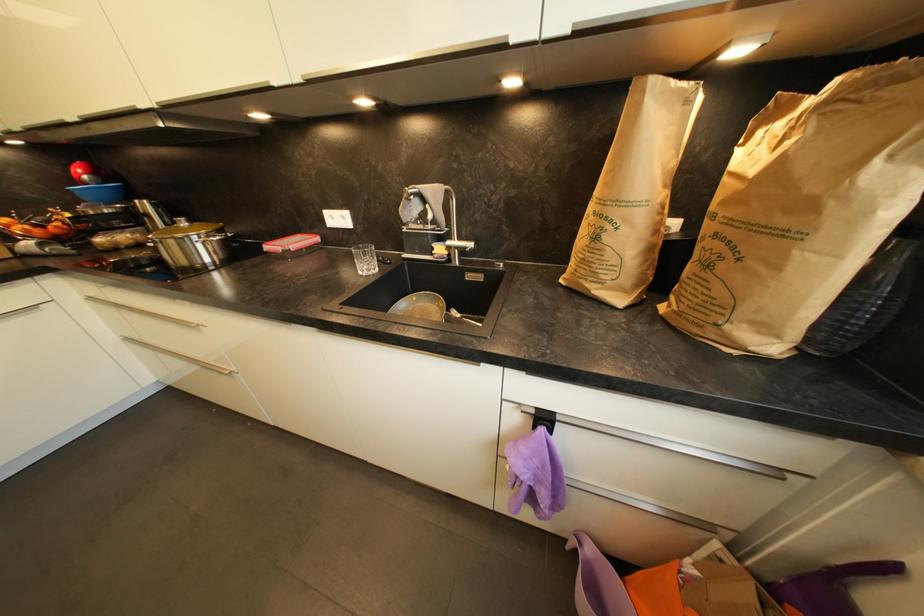
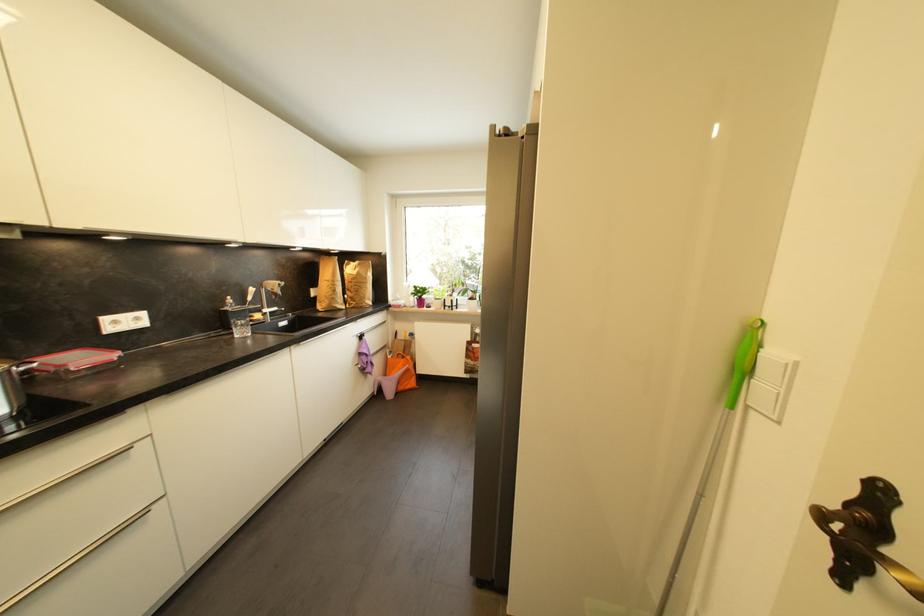
Where in the second image is the point corresponding to point 601,240 from the first image?

(339, 293)